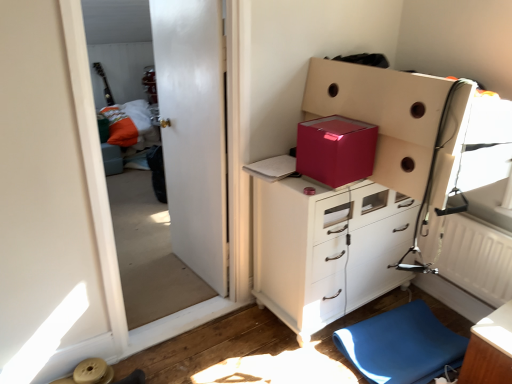
Question: Is white glossy door at upper left beside glossy cardboard box at upper center, which is counted as the first cardboard box, starting from the left?

Choices:
 (A) yes
 (B) no

Answer: (B)

Question: Is white glossy door at upper left at the left side of glossy cardboard box at upper center, which ranks as the second cardboard box in right-to-left order?

Choices:
 (A) no
 (B) yes

Answer: (B)

Question: From the image's perspective, is white glossy door at upper left located beneath glossy cardboard box at upper center, which is counted as the first cardboard box, starting from the left?

Choices:
 (A) yes
 (B) no

Answer: (A)

Question: Does white glossy door at upper left have a larger size compared to glossy cardboard box at upper center, which is counted as the first cardboard box, starting from the left?

Choices:
 (A) no
 (B) yes

Answer: (B)

Question: Is white glossy door at upper left located outside glossy cardboard box at upper center, which ranks as the second cardboard box in right-to-left order?

Choices:
 (A) yes
 (B) no

Answer: (A)

Question: Can you confirm if white glossy door at upper left is taller than glossy cardboard box at upper center, which ranks as the second cardboard box in right-to-left order?

Choices:
 (A) no
 (B) yes

Answer: (B)

Question: Is matte pink cardboard box at upper right, placed as the second cardboard box when sorted from left to right, positioned beyond the bounds of wooden table at lower right?

Choices:
 (A) yes
 (B) no

Answer: (A)

Question: Is matte pink cardboard box at upper right, marked as the first cardboard box in a right-to-left arrangement, positioned far away from wooden table at lower right?

Choices:
 (A) no
 (B) yes

Answer: (A)

Question: Is matte pink cardboard box at upper right, marked as the first cardboard box in a right-to-left arrangement, aimed at wooden table at lower right?

Choices:
 (A) yes
 (B) no

Answer: (B)

Question: Considering the relative sizes of matte pink cardboard box at upper right, marked as the first cardboard box in a right-to-left arrangement, and wooden table at lower right in the image provided, is matte pink cardboard box at upper right, marked as the first cardboard box in a right-to-left arrangement, taller than wooden table at lower right?

Choices:
 (A) no
 (B) yes

Answer: (A)

Question: Considering the relative sizes of matte pink cardboard box at upper right, placed as the second cardboard box when sorted from left to right, and wooden table at lower right in the image provided, is matte pink cardboard box at upper right, placed as the second cardboard box when sorted from left to right, bigger than wooden table at lower right?

Choices:
 (A) yes
 (B) no

Answer: (A)

Question: From the image's perspective, does matte pink cardboard box at upper right, marked as the first cardboard box in a right-to-left arrangement, appear lower than wooden table at lower right?

Choices:
 (A) no
 (B) yes

Answer: (A)

Question: Can you confirm if blue rubber mat at lower right is taller than matte white cabinet at center?

Choices:
 (A) no
 (B) yes

Answer: (A)